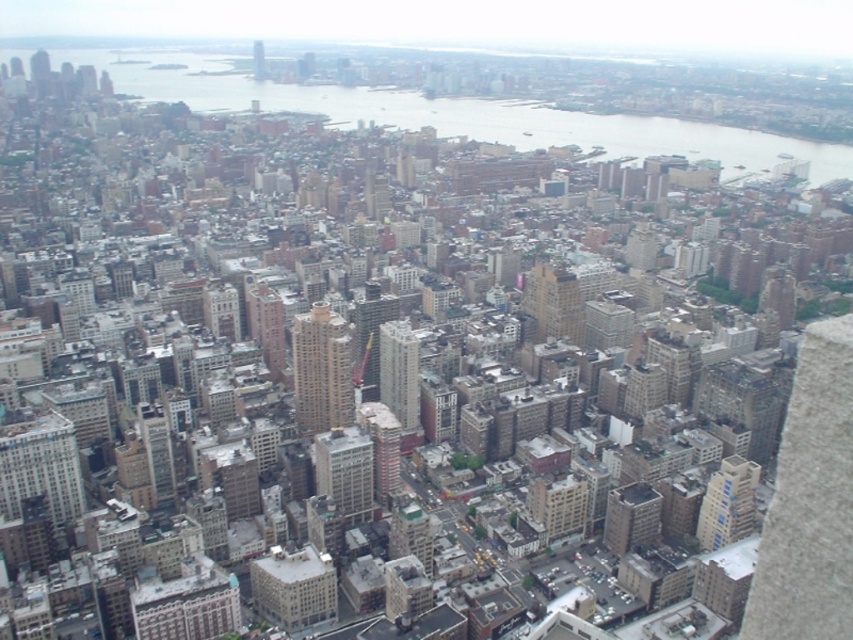
Is light beige concrete building at center bigger than smooth glass skyscraper at center?

Yes.

Does light beige concrete building at center have a greater width compared to smooth glass skyscraper at center?

Indeed, light beige concrete building at center has a greater width compared to smooth glass skyscraper at center.

Between point (556, 305) and point (257, 56), which one is positioned in front?

Positioned in front is point (556, 305).

Where is `light beige concrete building at center`? The height and width of the screenshot is (640, 853). light beige concrete building at center is located at coordinates (554, 301).

Does matte gray building at center appear under blue glass building at center-right?

Incorrect, matte gray building at center is not positioned below blue glass building at center-right.

This screenshot has width=853, height=640. Describe the element at coordinates (345, 472) in the screenshot. I see `matte gray building at center` at that location.

Is point (341, 452) positioned behind point (740, 490)?

No, (341, 452) is closer to viewer.

Where is `matte gray building at center`? Image resolution: width=853 pixels, height=640 pixels. matte gray building at center is located at coordinates (345, 472).

Which is more to the left, blue glass building at center-right or smooth glass skyscraper at center?

From the viewer's perspective, smooth glass skyscraper at center appears more on the left side.

Which is behind, point (724, 502) or point (262, 65)?

The point (262, 65) is behind.

At what (x,y) coordinates should I click in order to perform the action: click on blue glass building at center-right. Please return your answer as a coordinate pair (x, y). Looking at the image, I should click on (727, 502).